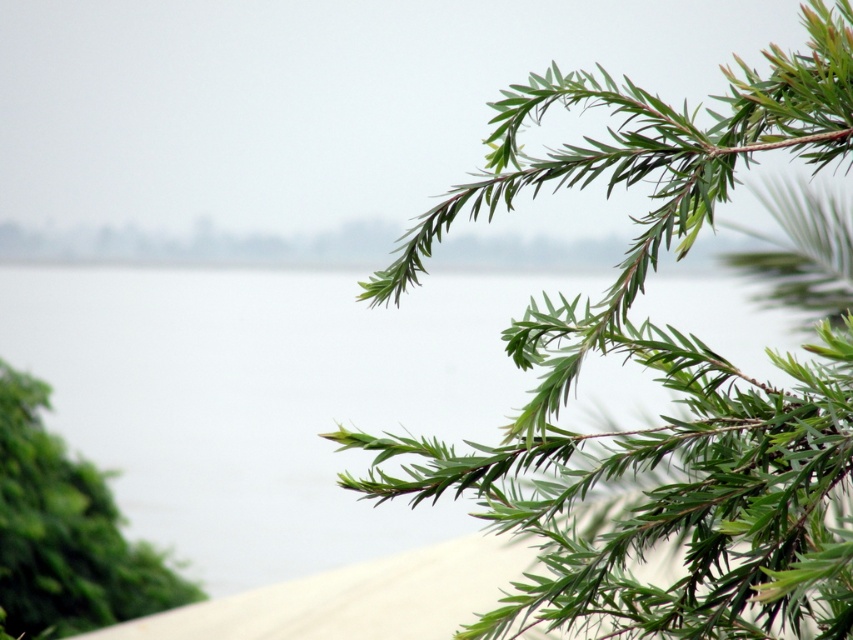
Is transparent water at upper center closer to the viewer compared to green leafy branch at lower left?

Yes.

This screenshot has width=853, height=640. I want to click on transparent water at upper center, so click(x=265, y=400).

Does green needle-like leaves at upper right have a larger size compared to transparent water at upper center?

No.

Which is behind, point (395, 492) or point (552, 282)?

The point (552, 282) is behind.

Image resolution: width=853 pixels, height=640 pixels. Identify the location of green needle-like leaves at upper right. (663, 380).

Does green needle-like leaves at upper right have a greater width compared to green leafy branch at lower left?

Yes.

This screenshot has width=853, height=640. Describe the element at coordinates (663, 380) in the screenshot. I see `green needle-like leaves at upper right` at that location.

Find the location of `green needle-like leaves at upper right`. green needle-like leaves at upper right is located at coordinates (663, 380).